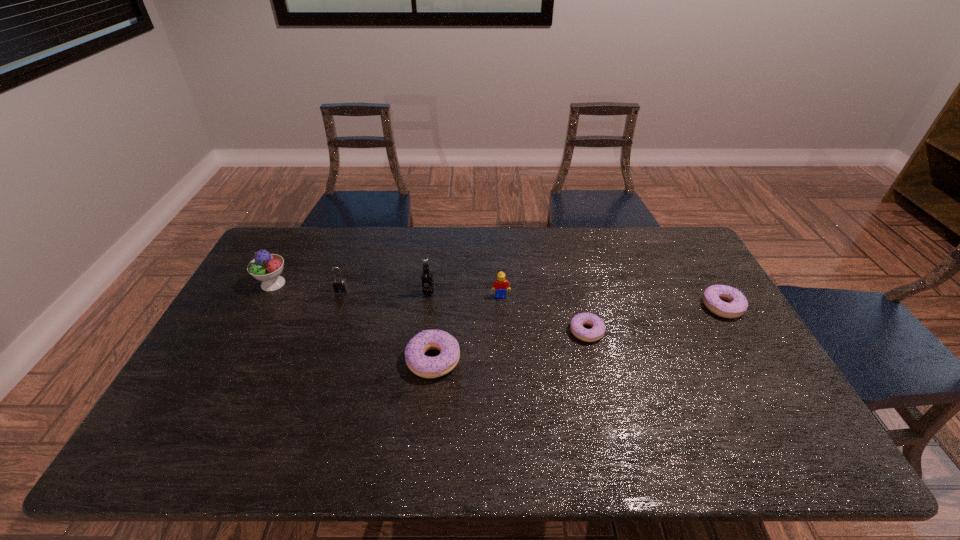
I want to click on empty location between the third object from right to left and the leftmost doughnut, so [467, 328].

Where is `empty space between the third object from right to left and the icecream`? This screenshot has width=960, height=540. empty space between the third object from right to left and the icecream is located at coordinates (387, 290).

Choose which object is the fifth nearest neighbor to the tallest doughnut. Please provide its 2D coordinates. Your answer should be formatted as a tuple, i.e. [(x, y)], where the tuple contains the x and y coordinates of a point satisfying the conditions above.

[(265, 267)]

Locate an element on the screen. object identified as the fourth closest to the second object from right to left is located at coordinates (426, 277).

Choose which doughnut is the nearest neighbor to the Lego. Please provide its 2D coordinates. Your answer should be formatted as a tuple, i.e. [(x, y)], where the tuple contains the x and y coordinates of a point satisfying the conditions above.

[(597, 331)]

At what (x,y) coordinates should I click in order to perform the action: click on doughnut that is the second closest to the padlock. Please return your answer as a coordinate pair (x, y). The height and width of the screenshot is (540, 960). Looking at the image, I should click on (597, 331).

Find the location of a particular element. The image size is (960, 540). free location that satisfies the following two spatial constraints: 1. on the label of the shortest doughnut; 2. on the right side of the root beer is located at coordinates (423, 332).

At what (x,y) coordinates should I click in order to perform the action: click on blank space that satisfies the following two spatial constraints: 1. on the shackle of the shortest object; 2. on the right side of the second object from left to right. Please return your answer as a coordinate pair (x, y). Looking at the image, I should click on (326, 332).

Where is `vacant space that satisfies the following two spatial constraints: 1. on the shackle of the second shortest object; 2. on the right side of the second object from left to right`? The width and height of the screenshot is (960, 540). vacant space that satisfies the following two spatial constraints: 1. on the shackle of the second shortest object; 2. on the right side of the second object from left to right is located at coordinates (335, 307).

You are a GUI agent. You are given a task and a screenshot of the screen. Output one action in this format:
    pyautogui.click(x=<x>, y=<y>)
    Task: Click on the free space that satisfies the following two spatial constraints: 1. on the shackle of the second object from left to right; 2. on the right side of the shortest object
    
    Given the screenshot: What is the action you would take?
    pyautogui.click(x=326, y=332)